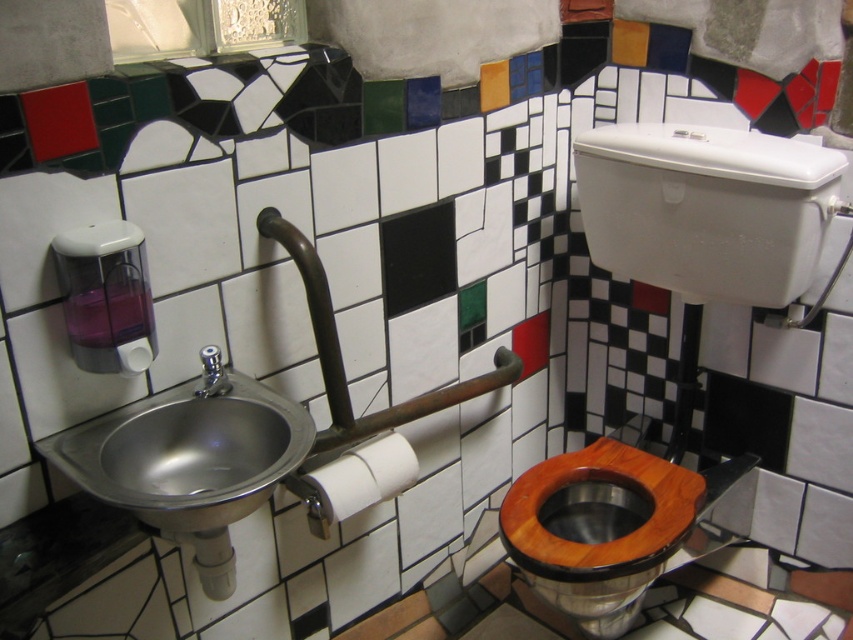
You are designing a bathroom layout and need to place a decorative item between the wooden at center and the white matte toilet paper at center. Which object should you place the item closer to if you want it to be near the larger object?

You should place the decorative item closer to the wooden at center because it is larger in size than the white matte toilet paper at center.

You are a plumber inspecting the bathroom and notice the satin nickel faucet at sink left and the white paper at sink left. Which object is wider?

The satin nickel faucet at sink left is wider than the white paper at sink left.